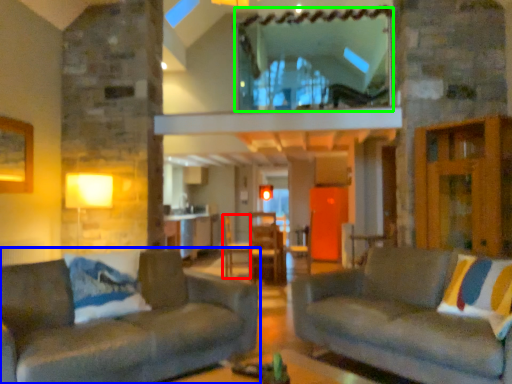
Question: Which object is the farthest from armchair (highlighted by a red box)? Choose among these: studio couch (highlighted by a blue box) or window (highlighted by a green box).

Choices:
 (A) studio couch
 (B) window

Answer: (A)